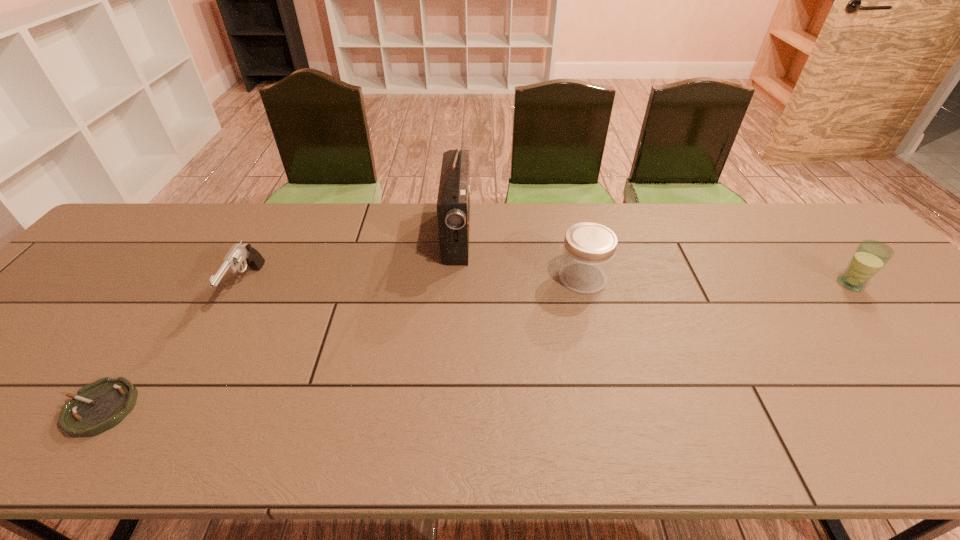
At what (x,y) coordinates should I click in order to perform the action: click on radio receiver. Please return your answer as a coordinate pair (x, y). The height and width of the screenshot is (540, 960). Looking at the image, I should click on (453, 203).

Locate an element on the screen. The width and height of the screenshot is (960, 540). the tallest object is located at coordinates (453, 203).

Locate an element on the screen. This screenshot has width=960, height=540. the second object from right to left is located at coordinates (589, 248).

The height and width of the screenshot is (540, 960). What are the coordinates of `the fourth object from right to left` in the screenshot? It's located at (239, 254).

Where is `glass`? This screenshot has width=960, height=540. glass is located at coordinates pyautogui.click(x=870, y=256).

Find the location of a particular element. the leftmost object is located at coordinates (99, 406).

Find the location of a particular element. the shortest object is located at coordinates (99, 406).

Image resolution: width=960 pixels, height=540 pixels. What are the coordinates of `free space located 0.230m on the front-facing side of the tallest object` in the screenshot? It's located at (546, 234).

At what (x,y) coordinates should I click in order to perform the action: click on vacant area located on the right of the second object from right to left. Please return your answer as a coordinate pair (x, y). Looking at the image, I should click on (630, 278).

Where is `vacant region located at the muzzle of the gun`? The width and height of the screenshot is (960, 540). vacant region located at the muzzle of the gun is located at coordinates (176, 416).